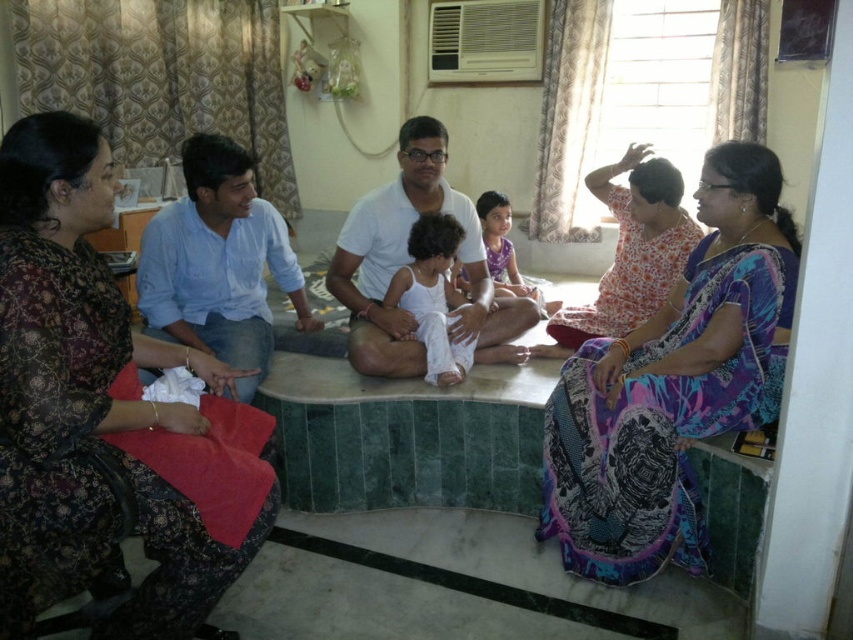
You are a photographer positioned at the center of the room. You want to capture a photo that includes both the dark floral dress at left and the floral print dress at upper right. What is the minimum distance you need to move backward to ensure both subjects are in frame?

The minimum distance to move backward is 5.28 feet to ensure both the dark floral dress at left and the floral print dress at upper right are in frame.

You are a photographer trying to capture a candid shot of both the dark floral dress at left and the floral print dress at upper right. Since you want to ensure both are in focus, which dress should you focus on first to maximize the chances of both being sharp?

You should focus on the dark floral dress at left first because it is closer to the viewer, and focusing on the closer subject increases the likelihood of both being in focus when using depth of field.

Where is the printed silk saree at right located in the image?

The printed silk saree at right is located at point (672,384) in the image.